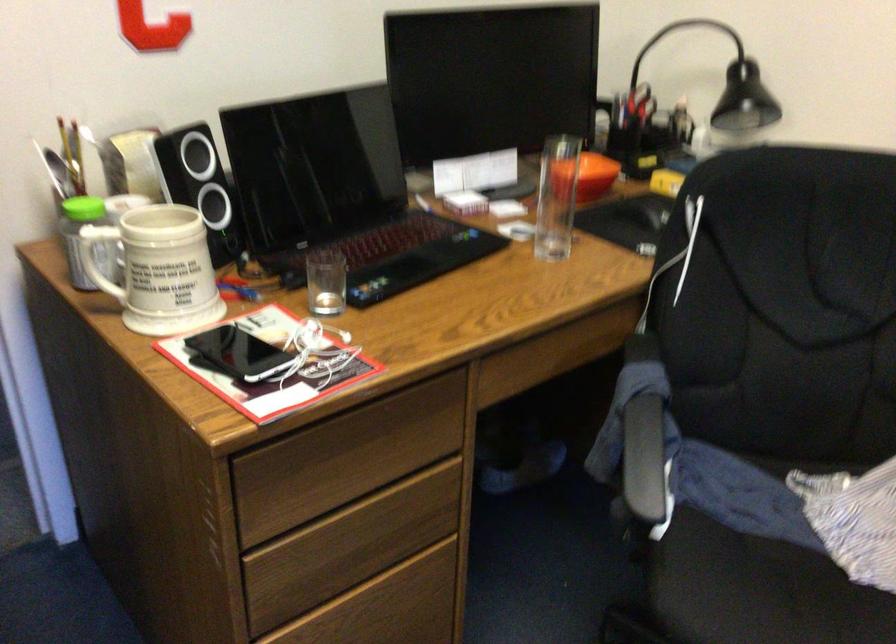
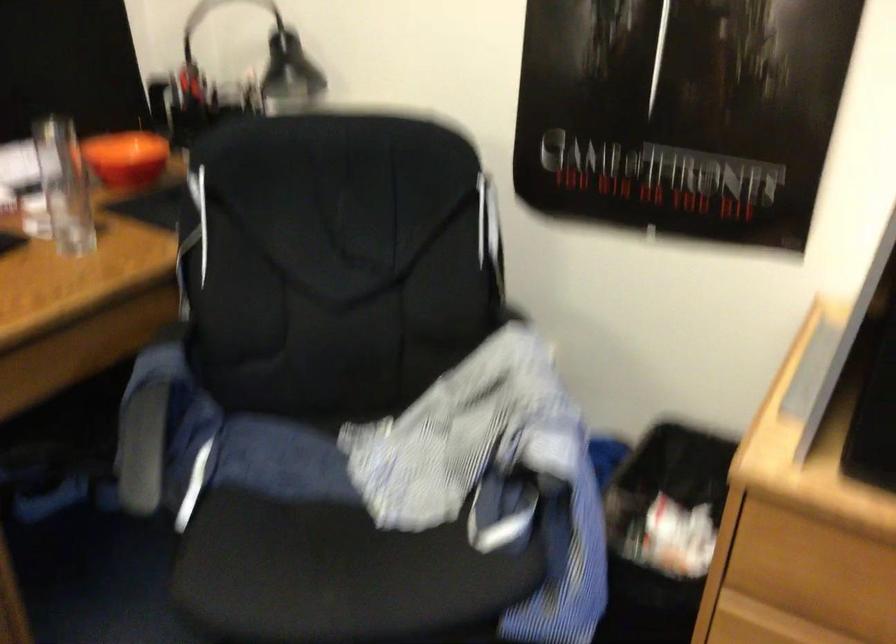
Question: Based on the continuous images, in which direction is the camera rotating? Reply with the corresponding letter.

Choices:
 (A) Left
 (B) Right
 (C) Up
 (D) Down

Answer: (B)